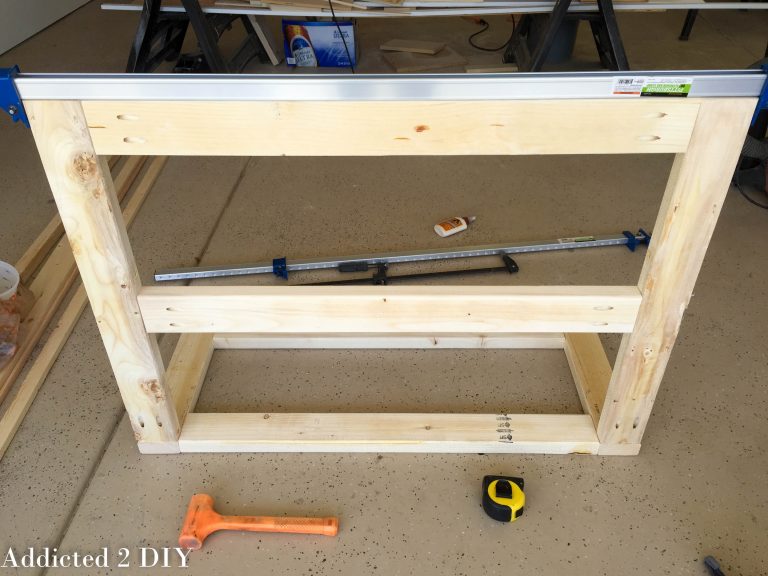
This screenshot has height=576, width=768. Identify the location of small bottle. (447, 232).